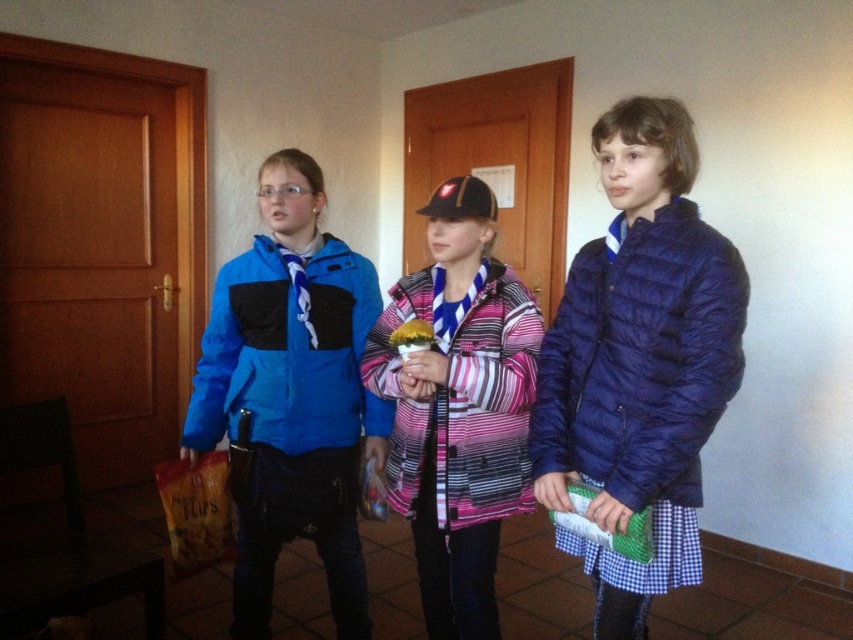
Question: From the image, what is the correct spatial relationship of blue fabric jacket at left in relation to matte blue puffer jacket at right?

Choices:
 (A) below
 (B) above

Answer: (A)

Question: Is pink striped jacket at center above matte blue puffer jacket at right?

Choices:
 (A) yes
 (B) no

Answer: (B)

Question: Which is farther from the blue fabric jacket at left?

Choices:
 (A) matte blue puffer jacket at right
 (B) blue synthetic jacket at left
 (C) pink striped jacket at center

Answer: (A)

Question: Based on their relative distances, which object is nearer to the matte blue puffer jacket at right?

Choices:
 (A) pink striped jacket at center
 (B) blue synthetic jacket at left

Answer: (A)

Question: Does pink striped jacket at center have a greater width compared to blue synthetic jacket at left?

Choices:
 (A) yes
 (B) no

Answer: (B)

Question: Which point appears closest to the camera in this image?

Choices:
 (A) [x=738, y=259]
 (B) [x=328, y=259]

Answer: (A)